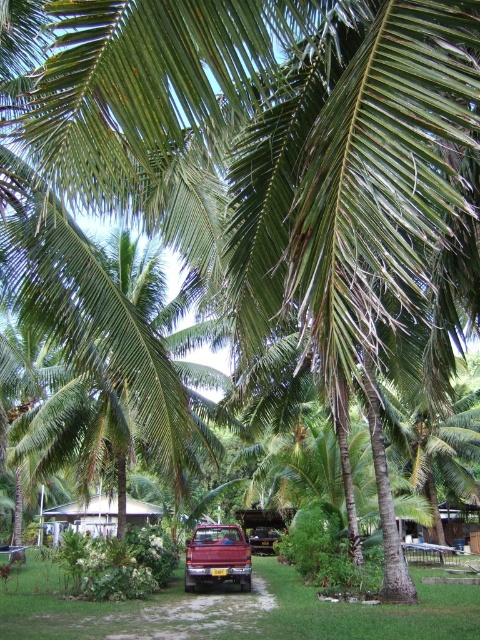
You are standing at the point with coordinates (x=216, y=556) in the image. What object is located at that point?

The point at coordinates (x=216, y=556) corresponds to the shiny red truck at center.

You are standing at the dirt path in the tropical scene. You see two points marked on the image, one at coordinates point (193, 385) and the other at point (273, 547). Which point is nearer to your current position?

Point (193, 385) is closer to the camera than point (273, 547), so the point at coordinates point (193, 385) is nearer to your current position.

You are standing at the point with coordinates point (83, 516) in the tropical scene. What structure can you see directly in front of you?

The point (83, 516) corresponds to the white corrugated metal hut at center, so you can see the white corrugated metal hut at center directly in front of you.